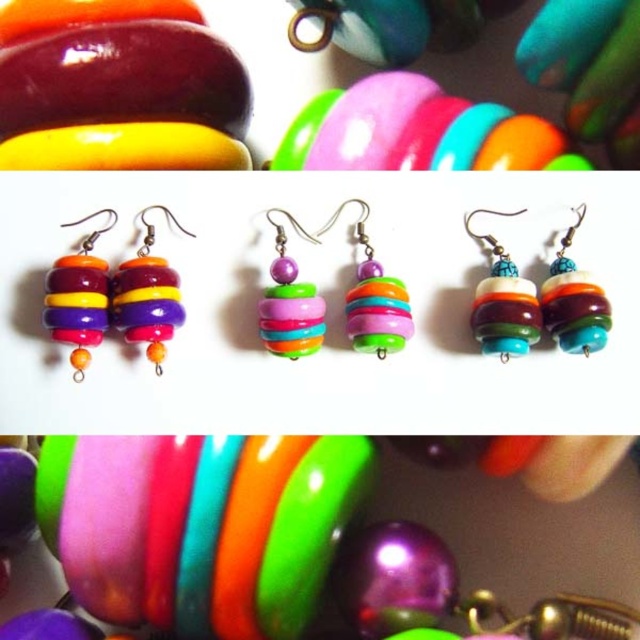
Question: Does glossy plastic bracelet at center lie behind matte glass beads at center?

Choices:
 (A) yes
 (B) no

Answer: (A)

Question: Among these objects, which one is nearest to the camera?

Choices:
 (A) glossy plastic bracelet at center
 (B) matte multicolored beads at center
 (C) shiny plastic bracelet at upper center

Answer: (B)

Question: Considering the real-world distances, which object is farthest from the matte multicolored beads at center?

Choices:
 (A) shiny plastic bracelet at upper center
 (B) glossy plastic bracelet at center
 (C) matte glass beads at center

Answer: (B)

Question: Among these points, which one is nearest to the camera?

Choices:
 (A) (561, 268)
 (B) (493, 289)
 (C) (316, 436)
 (D) (460, 164)

Answer: (B)

Question: From the image, what is the correct spatial relationship of matte glass beads at center in relation to matte multicolored beads at center?

Choices:
 (A) below
 (B) above

Answer: (A)

Question: Can you confirm if glossy plastic bracelet at center is bigger than matte multicolored beads at center?

Choices:
 (A) yes
 (B) no

Answer: (A)